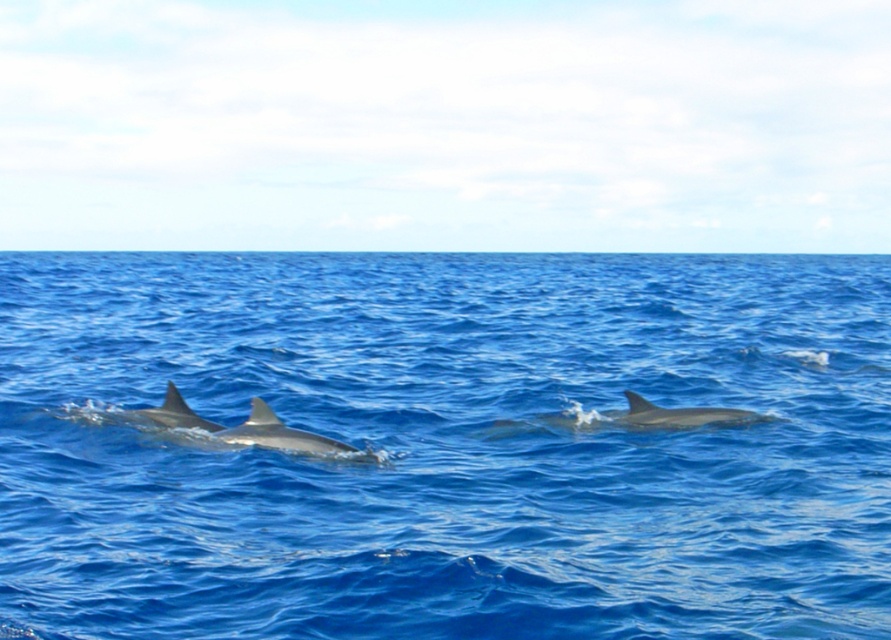
Is gray smooth dolphin at center thinner than glossy gray dolphin at center?

Correct, gray smooth dolphin at center's width is less than glossy gray dolphin at center's.

Can you confirm if gray smooth dolphin at center is bigger than glossy gray dolphin at center?

Correct, gray smooth dolphin at center is larger in size than glossy gray dolphin at center.

Does point (198, 420) come behind point (575, 419)?

No, it is not.

Identify the location of gray smooth dolphin at center. Image resolution: width=891 pixels, height=640 pixels. (244, 428).

Is blue smooth water at center bigger than glossy gray dolphin at center?

Correct, blue smooth water at center is larger in size than glossy gray dolphin at center.

Describe the element at coordinates (446, 445) in the screenshot. I see `blue smooth water at center` at that location.

The height and width of the screenshot is (640, 891). I want to click on blue smooth water at center, so click(446, 445).

The image size is (891, 640). What are the coordinates of `blue smooth water at center` in the screenshot? It's located at (446, 445).

Identify the location of blue smooth water at center. This screenshot has height=640, width=891. (446, 445).

Where is `blue smooth water at center`? This screenshot has height=640, width=891. blue smooth water at center is located at coordinates (446, 445).